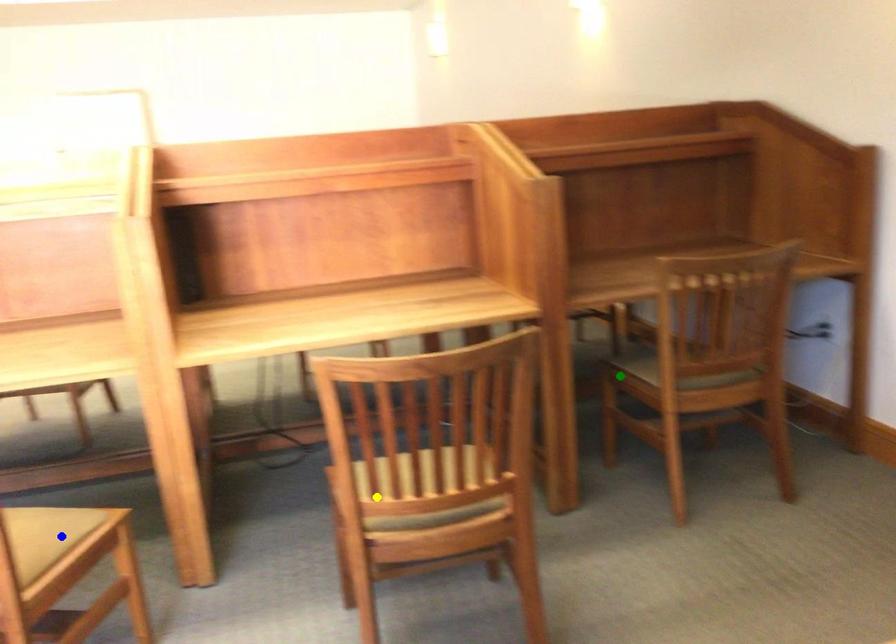
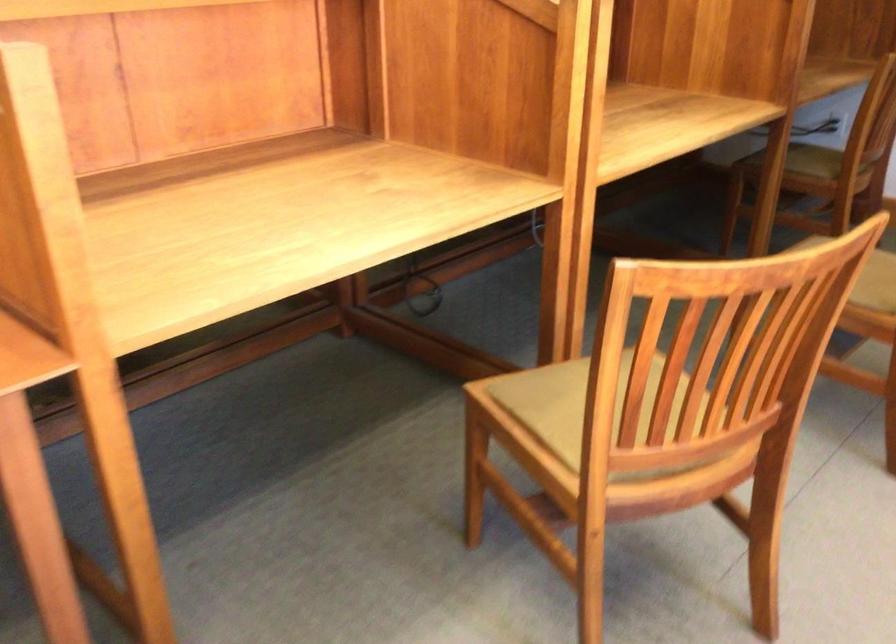
I am providing you with two images of the same scene from different viewpoints. Three points are marked in image1. Which point corresponds to a part or object that is occluded in image2?In image1, three points are marked. Which of them correspond to a part or object that is occluded in image2?Among the three points shown in image1, which one corresponds to a part or object that is no longer visible due to occlusion in image2?

Invisible in image2: blue point.